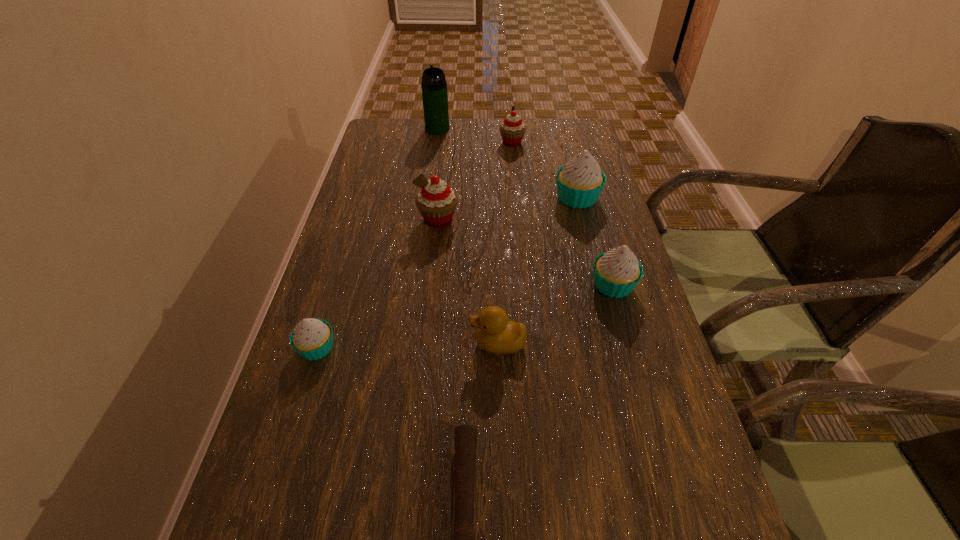
Locate an element on the screen. The image size is (960, 540). free space between the farthest white cupcake and the thermos bottle is located at coordinates (507, 163).

Find the location of `unoccupied position between the bigger pink cupcake and the seventh nearest object`. unoccupied position between the bigger pink cupcake and the seventh nearest object is located at coordinates (475, 181).

Identify the location of free space between the farther pink cupcake and the fifth farthest object. Image resolution: width=960 pixels, height=540 pixels. (563, 213).

The height and width of the screenshot is (540, 960). Find the location of `free space between the right pink cupcake and the duckling`. free space between the right pink cupcake and the duckling is located at coordinates (505, 243).

Where is `object that is the closest one to the second cupcake from left to right`? object that is the closest one to the second cupcake from left to right is located at coordinates (579, 183).

The height and width of the screenshot is (540, 960). I want to click on object that is the sixth closest to the third cupcake from right to left, so click(312, 339).

Identify which cupcake is located as the third nearest to the nearer pink cupcake. Please provide its 2D coordinates. Your answer should be formatted as a tuple, i.e. [(x, y)], where the tuple contains the x and y coordinates of a point satisfying the conditions above.

[(617, 272)]

Select which cupcake is the second closest to the second shortest object. Please provide its 2D coordinates. Your answer should be formatted as a tuple, i.e. [(x, y)], where the tuple contains the x and y coordinates of a point satisfying the conditions above.

[(617, 272)]

The width and height of the screenshot is (960, 540). Identify the location of pink cupcake that is the second closest to the nearest object. (512, 129).

Identify which pink cupcake is the nearest to the green thermos bottle. Please provide its 2D coordinates. Your answer should be formatted as a tuple, i.e. [(x, y)], where the tuple contains the x and y coordinates of a point satisfying the conditions above.

[(512, 129)]